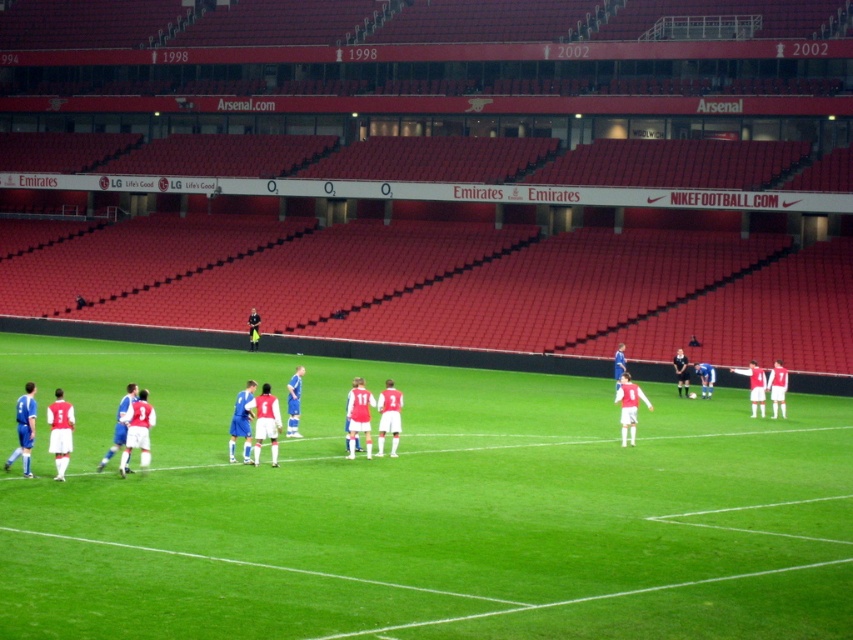
Does point (567, 541) come farther from viewer compared to point (621, 417)?

No.

Between green grass football field at center and matte red jersey at center, which one is positioned lower?

Positioned lower is green grass football field at center.

Which is behind, point (613, 618) or point (636, 388)?

Positioned behind is point (636, 388).

This screenshot has width=853, height=640. I want to click on green grass football field at center, so click(x=422, y=509).